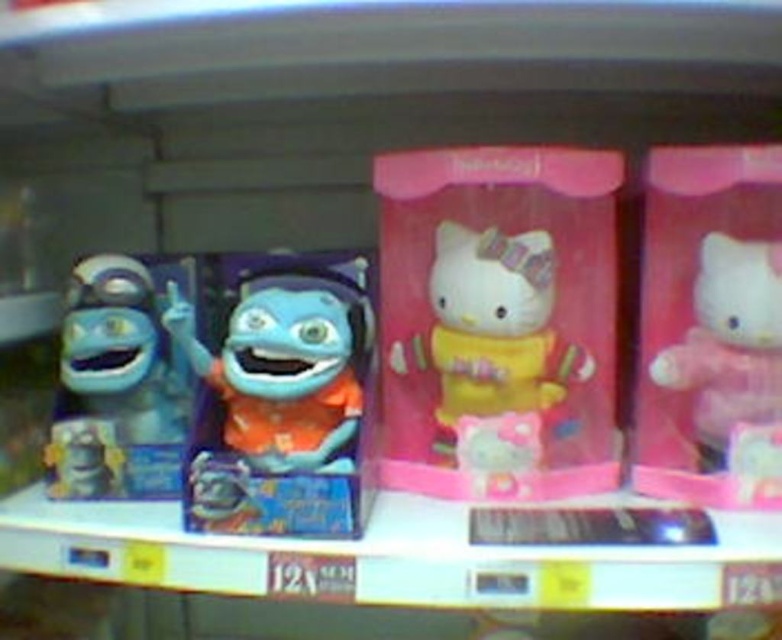
You are a store employee who needs to place a new toy box that is 60 centimeters wide on the shelf. The shelf currently has a matte blue plush at center. Can you fit the new toy box between the existing items without moving anything?

The existing items are 61.91 centimeters apart. Since the new toy box is 60 centimeters wide, it can fit between them as the space is slightly larger than the box.

You are a store employee who needs to arrange the matte blue plush at center and the matte blue plush toy at left on a shelf. If you want to place the larger one on the top shelf for visibility, which one should you choose?

The matte blue plush at center is bigger than the matte blue plush toy at left, so you should place the matte blue plush at center on the top shelf for visibility.

Looking at this image, you are a customer at a toy store looking to buy a gift for a friend. You want to choose the taller toy between the yellow matte hello kitty at center and the matte blue plush toy at left. Which one should you pick?

The yellow matte hello kitty at center is taller than the matte blue plush toy at left, so you should pick the yellow matte hello kitty at center.